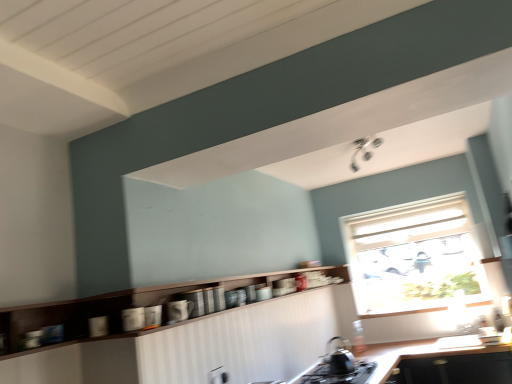
Question: From the image's perspective, is white textured window at upper right over glossy ceramic mug at lower center, the first appliance viewed from the front?

Choices:
 (A) no
 (B) yes

Answer: (A)

Question: Considering the relative sizes of white textured window at upper right and glossy ceramic mug at lower center, the first appliance viewed from the front, in the image provided, is white textured window at upper right smaller than glossy ceramic mug at lower center, the first appliance viewed from the front,?

Choices:
 (A) yes
 (B) no

Answer: (B)

Question: Would you say white textured window at upper right is a long distance from glossy ceramic mug at lower center, the first appliance viewed from the front?

Choices:
 (A) yes
 (B) no

Answer: (A)

Question: Is white textured window at upper right further to camera compared to glossy ceramic mug at lower center, the 2th appliance in the back-to-front sequence?

Choices:
 (A) no
 (B) yes

Answer: (B)

Question: From the image's perspective, would you say white textured window at upper right is shown under glossy ceramic mug at lower center, the 2th appliance in the back-to-front sequence?

Choices:
 (A) yes
 (B) no

Answer: (A)

Question: Does point (190, 317) appear closer or farther from the camera than point (346, 382)?

Choices:
 (A) closer
 (B) farther

Answer: (A)

Question: From a real-world perspective, is matte ceramic mug at center, marked as the second appliance in a front-to-back arrangement, above or below black matte gas stove at lower center?

Choices:
 (A) above
 (B) below

Answer: (A)

Question: Considering the relative positions of matte ceramic mug at center, positioned as the first appliance in back-to-front order, and black matte gas stove at lower center in the image provided, is matte ceramic mug at center, positioned as the first appliance in back-to-front order, to the left or to the right of black matte gas stove at lower center?

Choices:
 (A) right
 (B) left

Answer: (B)

Question: Relative to black matte gas stove at lower center, is matte ceramic mug at center, marked as the second appliance in a front-to-back arrangement, in front or behind?

Choices:
 (A) front
 (B) behind

Answer: (A)

Question: From the image's perspective, is black matte countertop at lower center above or below matte ceramic mug at center, marked as the second appliance in a front-to-back arrangement?

Choices:
 (A) below
 (B) above

Answer: (A)

Question: Considering the positions of black matte countertop at lower center and matte ceramic mug at center, marked as the second appliance in a front-to-back arrangement, in the image, is black matte countertop at lower center wider or thinner than matte ceramic mug at center, marked as the second appliance in a front-to-back arrangement,?

Choices:
 (A) thin
 (B) wide

Answer: (B)

Question: Is black matte countertop at lower center bigger or smaller than matte ceramic mug at center, positioned as the first appliance in back-to-front order?

Choices:
 (A) big
 (B) small

Answer: (A)

Question: Considering the positions of black matte countertop at lower center and matte ceramic mug at center, positioned as the first appliance in back-to-front order, in the image, is black matte countertop at lower center taller or shorter than matte ceramic mug at center, positioned as the first appliance in back-to-front order,?

Choices:
 (A) tall
 (B) short

Answer: (A)

Question: In terms of size, does matte ceramic mug at center, positioned as the first appliance in back-to-front order, appear bigger or smaller than black matte tea pot at lower center?

Choices:
 (A) big
 (B) small

Answer: (B)

Question: From a real-world perspective, is matte ceramic mug at center, positioned as the first appliance in back-to-front order, positioned above or below black matte tea pot at lower center?

Choices:
 (A) below
 (B) above

Answer: (B)